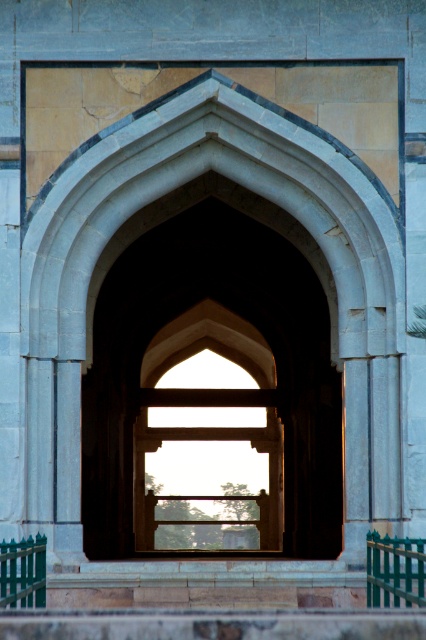
Question: Can you confirm if smooth stone arch at center is positioned above green painted metal railing at lower right?

Choices:
 (A) no
 (B) yes

Answer: (B)

Question: Can you confirm if green painted metal railing at lower right is positioned to the right of green painted wood at lower left?

Choices:
 (A) no
 (B) yes

Answer: (B)

Question: Which point appears farthest from the camera in this image?

Choices:
 (A) (281, 333)
 (B) (6, 560)

Answer: (A)

Question: Which point is farther to the camera?

Choices:
 (A) (316, 288)
 (B) (20, 564)
 (C) (382, 550)

Answer: (A)

Question: Among these points, which one is nearest to the camera?

Choices:
 (A) (20, 552)
 (B) (423, 576)

Answer: (B)

Question: Can you confirm if smooth stone arch at center is positioned to the left of green painted wood at lower left?

Choices:
 (A) no
 (B) yes

Answer: (A)